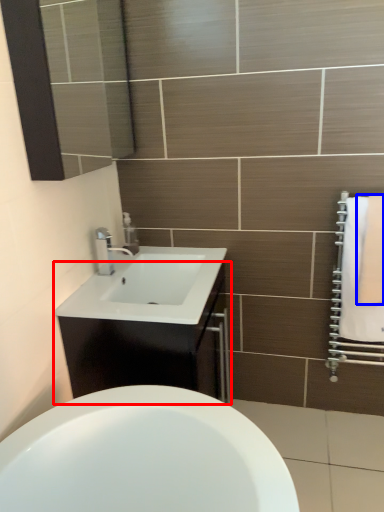
Question: Which point is closer to the camera, bathroom cabinet (highlighted by a red box) or bath towel (highlighted by a blue box)?

Choices:
 (A) bathroom cabinet
 (B) bath towel

Answer: (A)